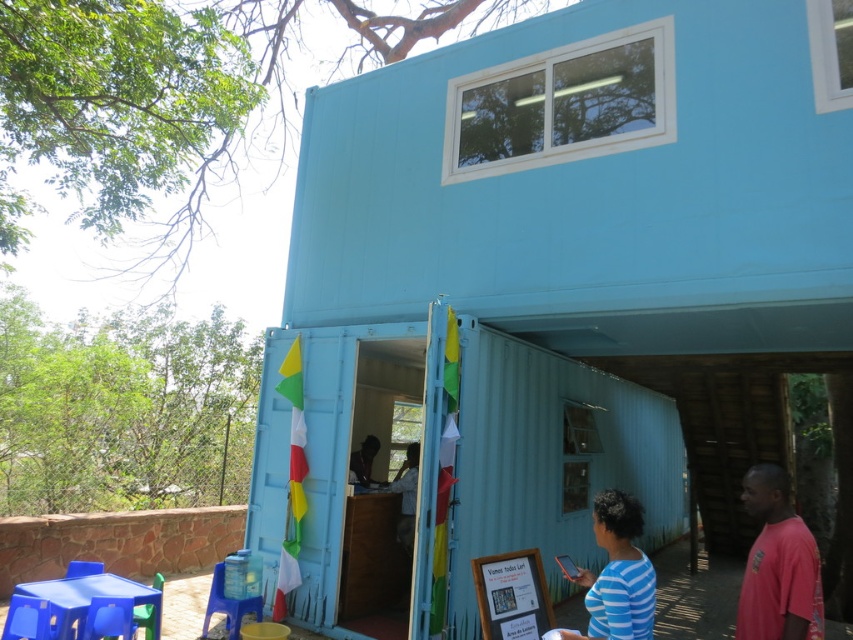
Question: Which object is positioned farthest from the blue plastic stool at lower left?

Choices:
 (A) blue striped shirt at lower center
 (B) matte black man at center
 (C) light blue corrugated metal container at center

Answer: (C)

Question: Is light blue corrugated metal container at center wider than blue striped shirt at lower center?

Choices:
 (A) no
 (B) yes

Answer: (A)

Question: Which of the following is the closest to the observer?

Choices:
 (A) (753, 566)
 (B) (363, 465)

Answer: (A)

Question: Which object is the closest to the blue striped shirt at lower center?

Choices:
 (A) light blue corrugated metal container at center
 (B) blue plastic stool at lower left

Answer: (B)

Question: Does light blue corrugated metal container at center appear over blue striped shirt at lower center?

Choices:
 (A) yes
 (B) no

Answer: (A)

Question: Is blue striped shirt at lower center to the right of blue plastic stool at lower left from the viewer's perspective?

Choices:
 (A) yes
 (B) no

Answer: (A)